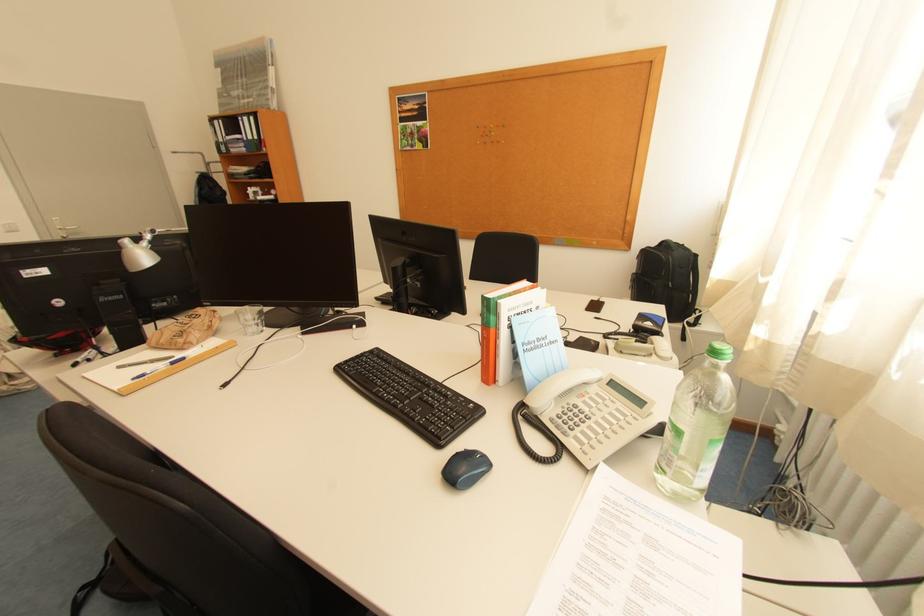
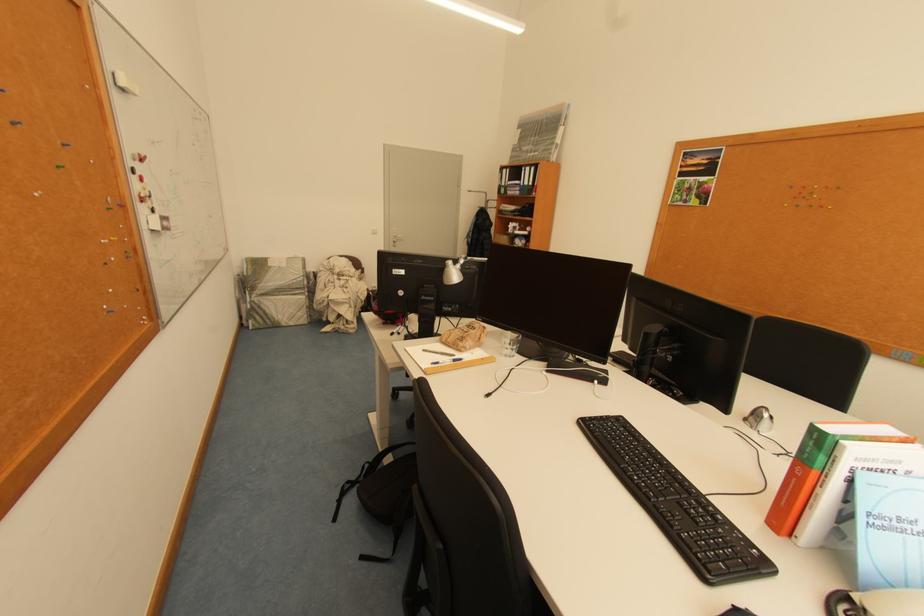
Locate, in the second image, the point that corresponds to (x=253, y=336) in the first image.

(508, 355)